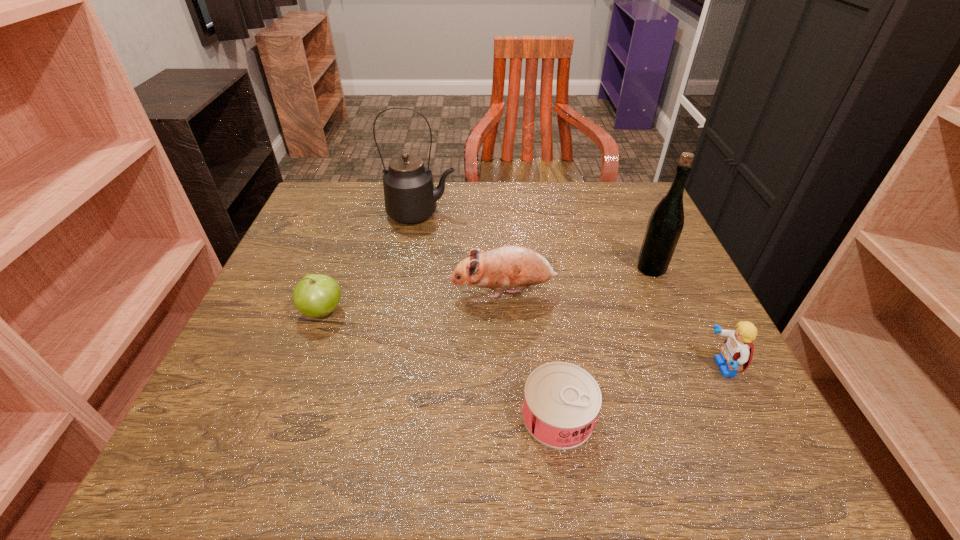
Find the location of `kettle`. kettle is located at coordinates pyautogui.click(x=410, y=196).

You are a GUI agent. You are given a task and a screenshot of the screen. Output one action in this format:
    pyautogui.click(x=<x>, y=<y>)
    Task: Click on the beer bottle
    
    Given the screenshot: What is the action you would take?
    pyautogui.click(x=666, y=221)

You are a GUI agent. You are given a task and a screenshot of the screen. Output one action in this format:
    pyautogui.click(x=<x>, y=<y>)
    Task: Click on the hamster
    The image size is (960, 540).
    Given the screenshot: What is the action you would take?
    pyautogui.click(x=509, y=266)

Locate an element on the screen. The width and height of the screenshot is (960, 540). Lego is located at coordinates (738, 349).

Where is `apple`? Image resolution: width=960 pixels, height=540 pixels. apple is located at coordinates (316, 295).

I want to click on can, so click(561, 403).

At what (x,y) coordinates should I click in order to perform the action: click on the shortest object. Please return your answer as a coordinate pair (x, y). Looking at the image, I should click on point(561,403).

You are a GUI agent. You are given a task and a screenshot of the screen. Output one action in this format:
    pyautogui.click(x=<x>, y=<y>)
    Task: Click on the vacant area located 0.390m spout on the farthest object
    The height and width of the screenshot is (540, 960).
    Given the screenshot: What is the action you would take?
    pyautogui.click(x=607, y=213)

You are a GUI agent. You are given a task and a screenshot of the screen. Output one action in this format:
    pyautogui.click(x=<x>, y=<y>)
    Task: Click on the free space located 0.230m on the left of the beer bottle
    Image resolution: width=960 pixels, height=540 pixels.
    Given the screenshot: What is the action you would take?
    pyautogui.click(x=534, y=268)

You are a GUI agent. You are given a task and a screenshot of the screen. Output one action in this format:
    pyautogui.click(x=<x>, y=<y>)
    Task: Click on the vacant region located 0.260m at the face of the hamster
    Image resolution: width=960 pixels, height=540 pixels.
    Given the screenshot: What is the action you would take?
    pyautogui.click(x=329, y=291)